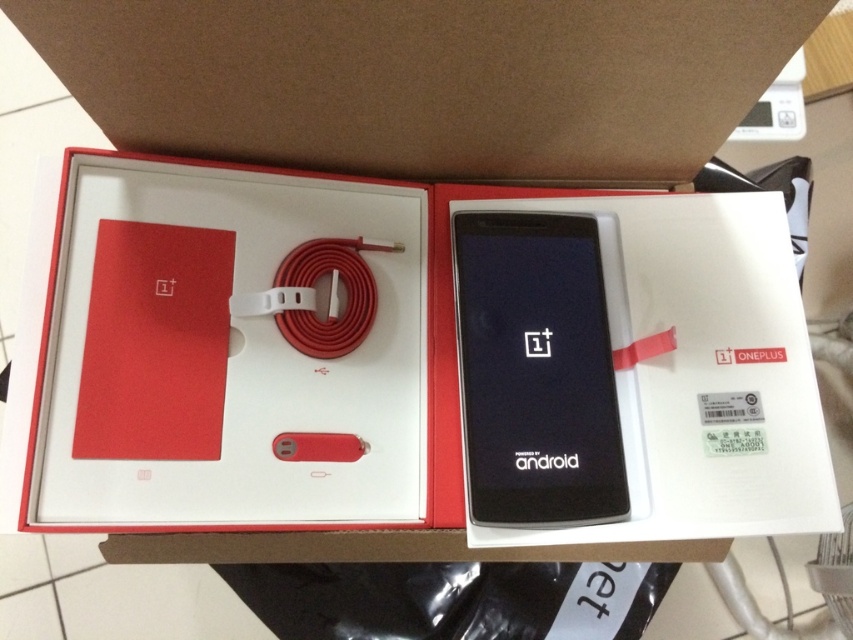
From the picture: Which is above, white matte cardboard box at center or black glossy phone at center?

black glossy phone at center is above.

Which is more to the right, white matte cardboard box at center or black glossy phone at center?

black glossy phone at center

Between point (610, 234) and point (469, 384), which one is positioned in front?

Point (469, 384)

Identify the location of white matte cardboard box at center. This screenshot has height=640, width=853. (384, 371).